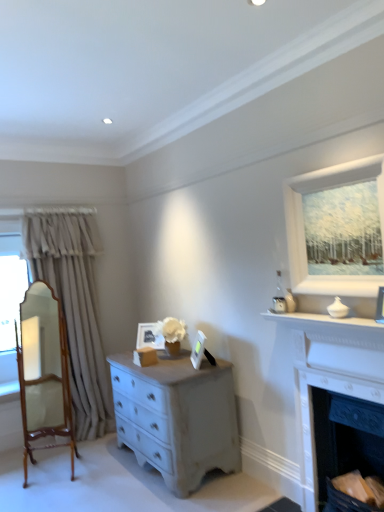
Question: Should I look upward or downward to see wooden polished mirror at left?

Choices:
 (A) up
 (B) down

Answer: (B)

Question: Does beige fabric curtain at left have a larger size compared to white glossy picture frame at center, the second picture frame when ordered from back to front?

Choices:
 (A) no
 (B) yes

Answer: (B)

Question: From a real-world perspective, is beige fabric curtain at left on top of white glossy picture frame at center, which is counted as the second picture frame, starting from the top?

Choices:
 (A) yes
 (B) no

Answer: (A)

Question: Would you say beige fabric curtain at left is a long distance from white glossy picture frame at center, which is counted as the second picture frame, starting from the top?

Choices:
 (A) yes
 (B) no

Answer: (A)

Question: Is beige fabric curtain at left taller than white glossy picture frame at center, which appears as the 2th picture frame when viewed from the front?

Choices:
 (A) yes
 (B) no

Answer: (A)

Question: Is beige fabric curtain at left thinner than white glossy picture frame at center, acting as the 2th picture frame starting from the left?

Choices:
 (A) no
 (B) yes

Answer: (A)

Question: Does beige fabric curtain at left appear on the right side of white glossy picture frame at center, which appears as the 2th picture frame when viewed from the front?

Choices:
 (A) no
 (B) yes

Answer: (A)

Question: Is white painted wood at upper right far away from white glossy picture frame at center, which appears as the 2th picture frame when viewed from the front?

Choices:
 (A) no
 (B) yes

Answer: (B)

Question: From a real-world perspective, is white painted wood at upper right located beneath white glossy picture frame at center, which appears as the 2th picture frame when viewed from the front?

Choices:
 (A) no
 (B) yes

Answer: (A)

Question: Is the surface of white painted wood at upper right in direct contact with white glossy picture frame at center, which is the second picture frame from right to left?

Choices:
 (A) yes
 (B) no

Answer: (B)

Question: From the image's perspective, is white painted wood at upper right located above white glossy picture frame at center, which appears as the 2th picture frame when viewed from the front?

Choices:
 (A) no
 (B) yes

Answer: (B)

Question: Does white painted wood at upper right have a lesser width compared to white glossy picture frame at center, which appears as the 2th picture frame when viewed from the front?

Choices:
 (A) no
 (B) yes

Answer: (B)

Question: Is white painted wood at upper right positioned beyond the bounds of white glossy picture frame at center, the 2th picture frame in the bottom-to-top sequence?

Choices:
 (A) no
 (B) yes

Answer: (B)

Question: Is beige fabric curtain at left looking in the opposite direction of dark gray stone fireplace at lower right, the 2th fireplace when ordered from top to bottom?

Choices:
 (A) no
 (B) yes

Answer: (A)